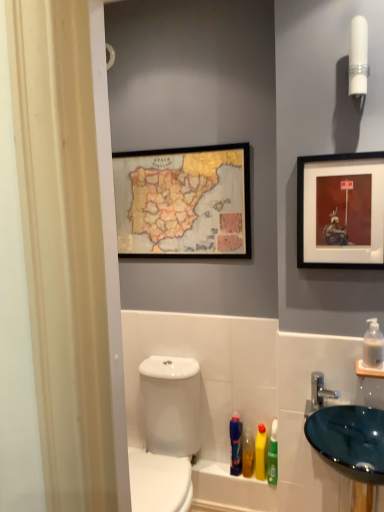
Question: Considering the relative sizes of translucent plastic mouthwash at lower right, the 1th mouthwash from the back, and white glossy toilet at lower left in the image provided, is translucent plastic mouthwash at lower right, the 1th mouthwash from the back, bigger than white glossy toilet at lower left?

Choices:
 (A) yes
 (B) no

Answer: (B)

Question: From a real-world perspective, is translucent plastic mouthwash at lower right, which is the second mouthwash in left-to-right order, below white glossy toilet at lower left?

Choices:
 (A) yes
 (B) no

Answer: (A)

Question: Does translucent plastic mouthwash at lower right, arranged as the fourth mouthwash when viewed from the front, have a smaller size compared to white glossy toilet at lower left?

Choices:
 (A) no
 (B) yes

Answer: (B)

Question: Is translucent plastic mouthwash at lower right, marked as the fourth mouthwash in a top-to-bottom arrangement, next to white glossy toilet at lower left and touching it?

Choices:
 (A) no
 (B) yes

Answer: (A)

Question: Is white glossy toilet at lower left at the back of translucent plastic mouthwash at lower right, arranged as the fourth mouthwash when viewed from the front?

Choices:
 (A) no
 (B) yes

Answer: (B)

Question: Is translucent plastic mouthwash at lower right, which is the second mouthwash in left-to-right order, positioned before white glossy toilet at lower left?

Choices:
 (A) no
 (B) yes

Answer: (A)

Question: From a real-world perspective, is silver metallic faucet at lower right on top of matte black picture frame at upper right, which is the first picture frame from right to left?

Choices:
 (A) no
 (B) yes

Answer: (A)

Question: Is silver metallic faucet at lower right wider than matte black picture frame at upper right, which is the 2th picture frame in left-to-right order?

Choices:
 (A) no
 (B) yes

Answer: (B)

Question: From the image's perspective, is silver metallic faucet at lower right over matte black picture frame at upper right, which is the 2th picture frame in left-to-right order?

Choices:
 (A) yes
 (B) no

Answer: (B)

Question: Considering the relative sizes of silver metallic faucet at lower right and matte black picture frame at upper right, the first picture frame in the front-to-back sequence, in the image provided, is silver metallic faucet at lower right thinner than matte black picture frame at upper right, the first picture frame in the front-to-back sequence,?

Choices:
 (A) no
 (B) yes

Answer: (A)

Question: Is silver metallic faucet at lower right facing away from matte black picture frame at upper right, which is the first picture frame from right to left?

Choices:
 (A) no
 (B) yes

Answer: (A)

Question: Considering the relative sizes of silver metallic faucet at lower right and matte black picture frame at upper right, acting as the second picture frame starting from the back, in the image provided, is silver metallic faucet at lower right smaller than matte black picture frame at upper right, acting as the second picture frame starting from the back,?

Choices:
 (A) no
 (B) yes

Answer: (B)

Question: Is white plastic tube at upper right surrounding clear plastic pump at right, positioned as the 1th mouthwash in right-to-left order?

Choices:
 (A) no
 (B) yes

Answer: (A)